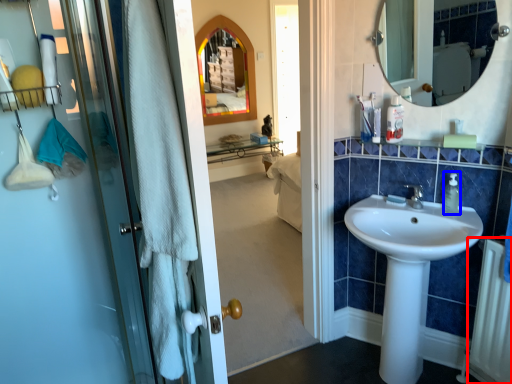
Question: Among these objects, which one is farthest to the camera, radiator (highlighted by a red box) or soap dispenser (highlighted by a blue box)?

Choices:
 (A) radiator
 (B) soap dispenser

Answer: (B)